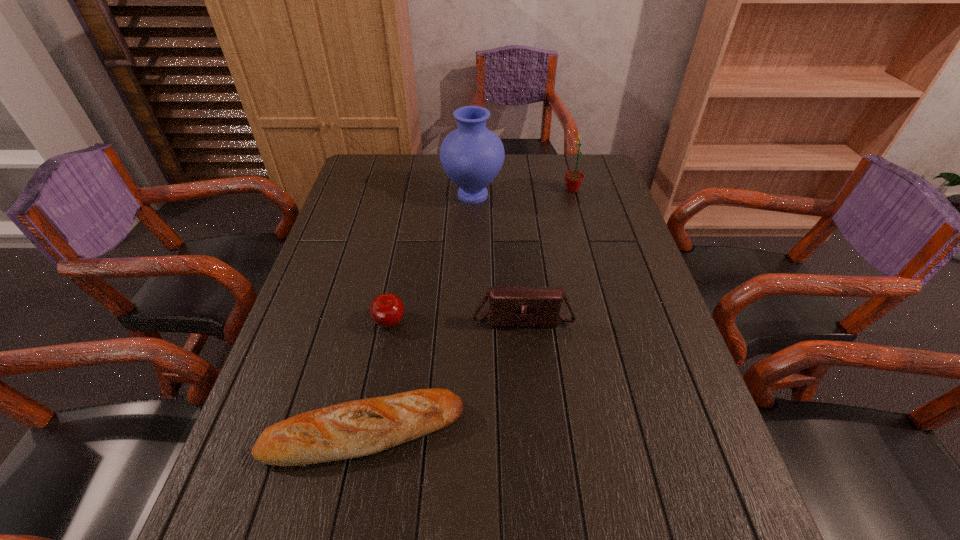
Where is `blank space at the left edge of the desktop`? This screenshot has height=540, width=960. blank space at the left edge of the desktop is located at coordinates (343, 325).

Locate an element on the screen. vacant space at the right edge of the desktop is located at coordinates (608, 320).

Locate an element on the screen. This screenshot has height=540, width=960. free space at the far right corner is located at coordinates (597, 172).

This screenshot has height=540, width=960. In order to click on empty space that is in between the shoulder bag and the rightmost object in this screenshot , I will do `click(547, 254)`.

Where is `free space between the vase and the sunflower`? This screenshot has height=540, width=960. free space between the vase and the sunflower is located at coordinates (522, 193).

The width and height of the screenshot is (960, 540). I want to click on vacant area that lies between the nearest object and the shoulder bag, so click(444, 375).

Where is `blank region between the shoulder bag and the shortest object`? The height and width of the screenshot is (540, 960). blank region between the shoulder bag and the shortest object is located at coordinates (444, 375).

Where is `unoccupied position between the baguet and the sunflower`? The height and width of the screenshot is (540, 960). unoccupied position between the baguet and the sunflower is located at coordinates (468, 310).

Where is `free point between the vase and the second shortest object`? The width and height of the screenshot is (960, 540). free point between the vase and the second shortest object is located at coordinates (431, 260).

Identify the location of vacant area between the cherry and the nearest object. (377, 378).